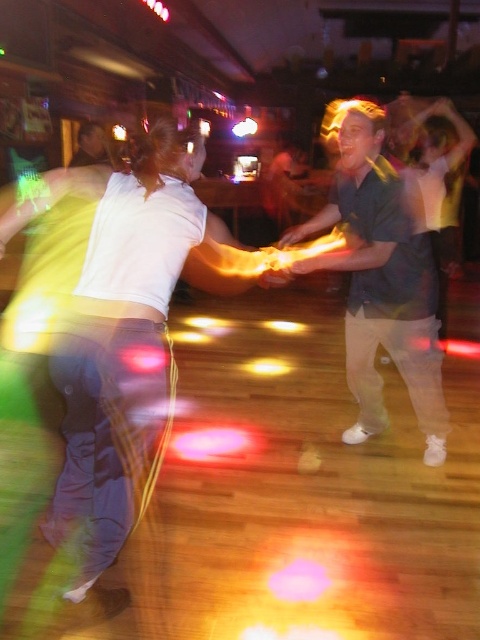
Which is in front, point (84, 332) or point (416, 257)?

Point (84, 332)

Between point (127, 232) and point (428, 432), which one is positioned behind?

The point (428, 432) is more distant.

Which is in front, point (62, 387) or point (368, 134)?

Point (62, 387) is in front.

Locate an element on the screen. white matte pants at center is located at coordinates (124, 346).